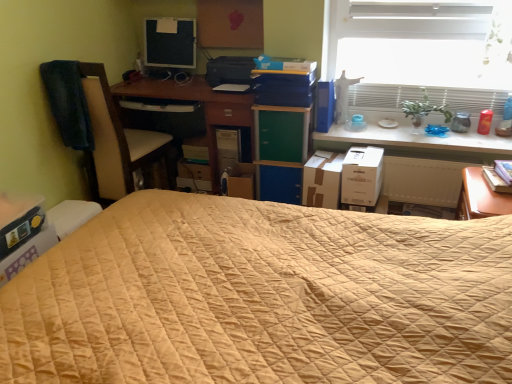
Question: Is brown leather swivel chair at left in front of or behind white glossy table at upper right in the image?

Choices:
 (A) front
 (B) behind

Answer: (A)

Question: In terms of width, does brown leather swivel chair at left look wider or thinner when compared to white glossy table at upper right?

Choices:
 (A) wide
 (B) thin

Answer: (A)

Question: Which is farther from the green matte/blackboard at center, placed as the 3th paperback book when sorted from right to left?

Choices:
 (A) hardcover book at right, the 1th paperback book from the right
 (B) matte black computer tower at center
 (C) cardboard box at lower left, placed as the 1th cardboard box when sorted from left to right
 (D) white glossy table at upper right
 (E) matte black monitor at upper left

Answer: (C)

Question: Which of these objects is positioned closest to the hardcover book at right, the 1th paperback book from the right?

Choices:
 (A) green matte file cabinet at center
 (B) green matte/blackboard at center, the second paperback book when ordered from left to right
 (C) white glossy table at upper right
 (D) blue matte book at upper right, the second paperback book from the right
 (E) transparent glass window at upper right

Answer: (C)